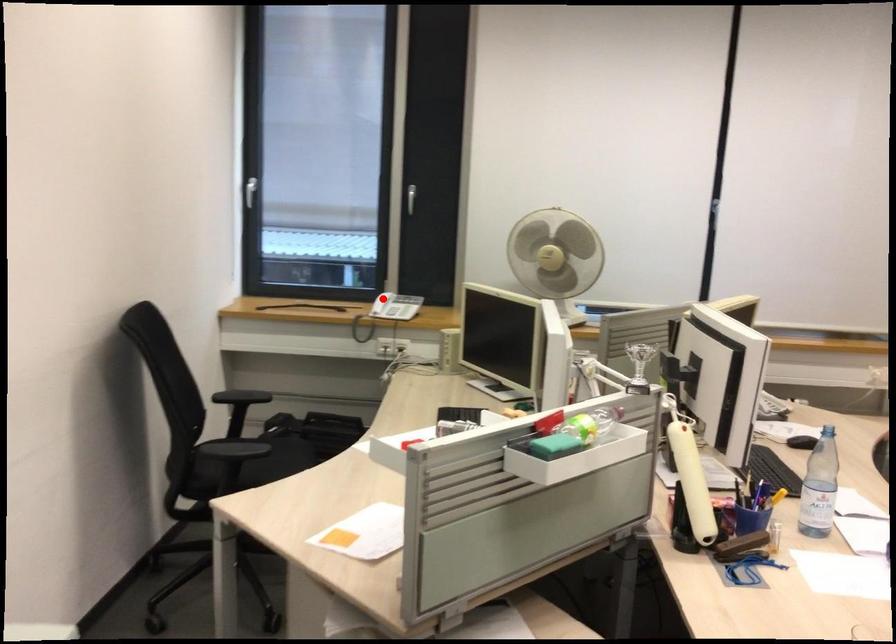
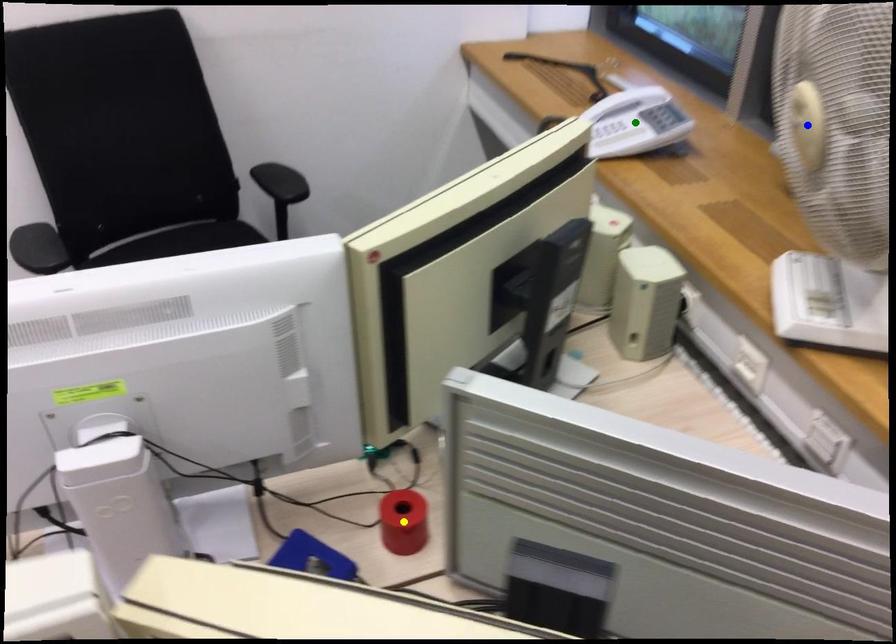
Question: I am providing you with two images of the same scene from different viewpoints. A red point is marked on the first image. You are given multiple points on the second image. Which point in image 2 is actually the same real-world point as the red point in image 1?

Choices:
 (A) yellow point
 (B) blue point
 (C) green point

Answer: (C)